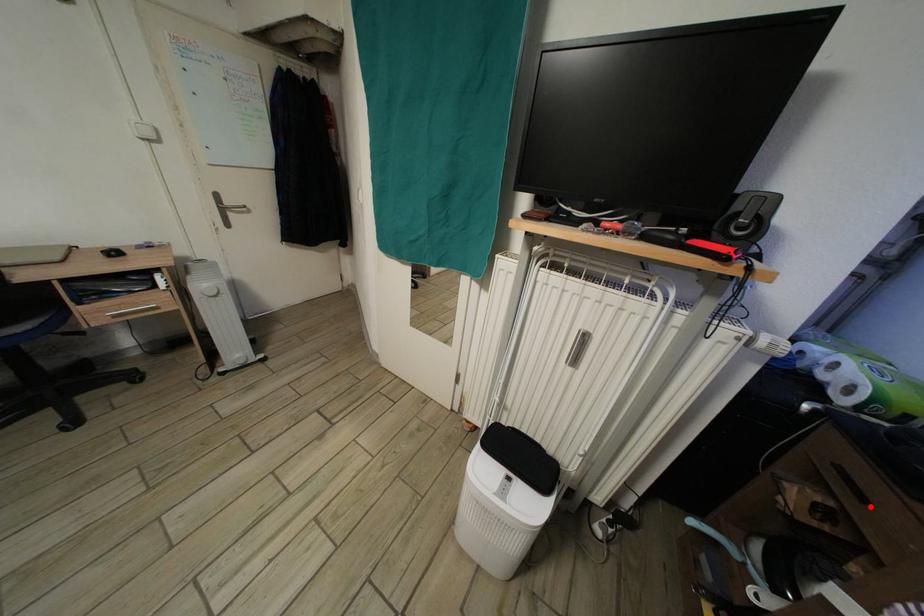
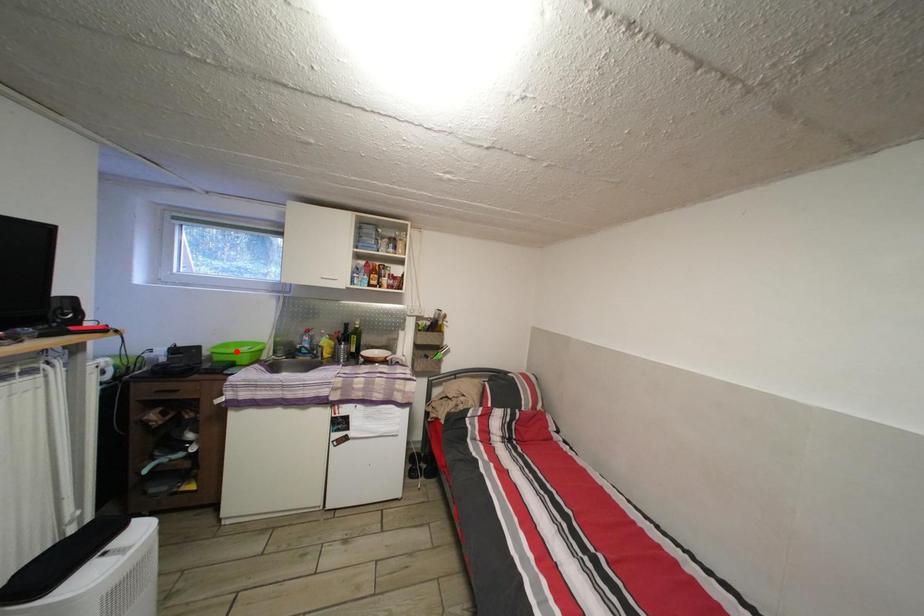
I am providing you with two images of the same scene from different viewpoints. A red point is marked on the first image and another point is marked on the second image. Does the point marked in image1 correspond to the same location as the one in image2?

No